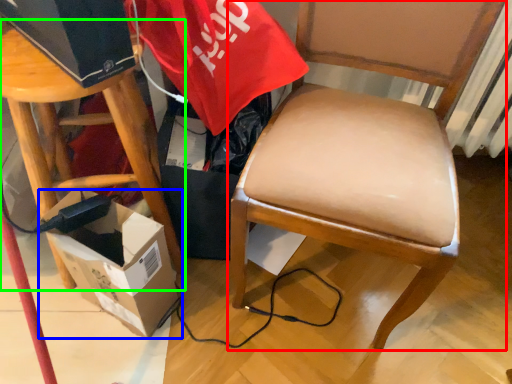
Question: Based on their relative distances, which object is nearer to chair (highlighted by a red box)? Choose from box (highlighted by a blue box) and stool (highlighted by a green box).

Choices:
 (A) box
 (B) stool

Answer: (A)